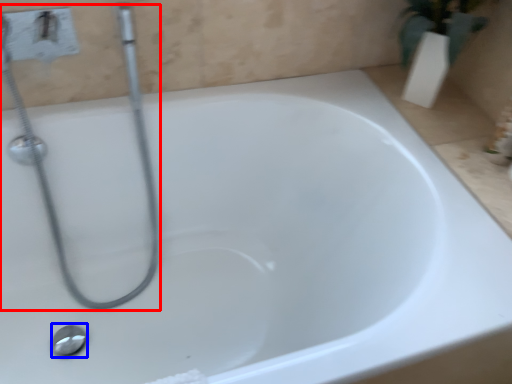
Question: Among these objects, which one is farthest to the camera, plumbing fixture (highlighted by a red box) or shower (highlighted by a blue box)?

Choices:
 (A) plumbing fixture
 (B) shower

Answer: (B)